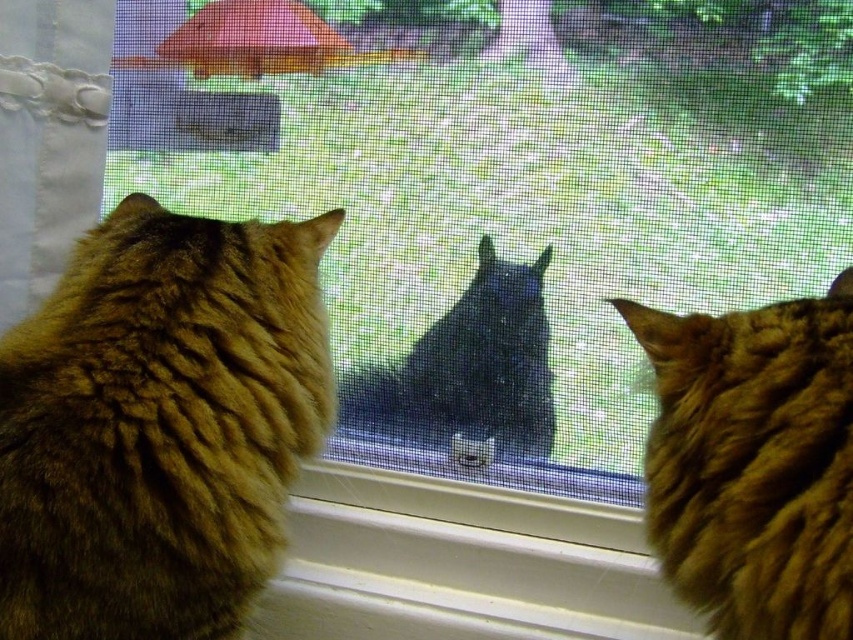
You are a cat owner who wants to feed both the fuzzy brown cat at right and the black fur cat at center. Since the window is closed, you need to place the food on the windowsill so they can eat through the screen. The food bowl you have is 15 cm in diameter. Which cat can comfortably eat from the bowl without the other interfering?

The fuzzy brown cat at right is larger compared to the black fur cat at center. Since the fuzzy brown cat at right is bigger, it might dominate the space, making it difficult for the smaller black fur cat at center to eat comfortably. Therefore, the black fur cat at center would need a separate bowl to avoid conflict.

You are a photographer trying to capture a clear photo of both the fuzzy brown cat at right and the black fur cat at center through the window screen. Considering their positions, which cat will appear larger in your photo?

The fuzzy brown cat at right will appear larger in the photo because it is closer to the viewer than the black fur cat at center.

You are trying to determine which cat is wider based on their positions in the image. The fuzzy brown cat at right and the black fur cat at center are both visible. Which one has a greater width?

The black fur cat at center has a greater width than the fuzzy brown cat at right because the fuzzy brown cat at right is narrower.